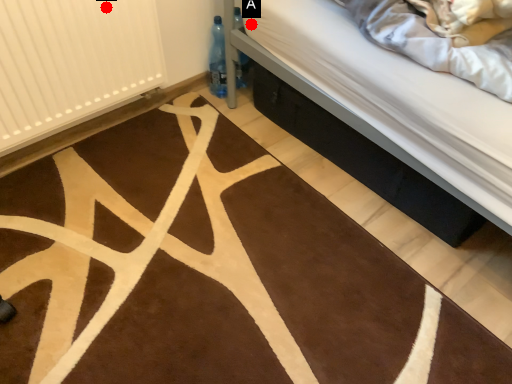
Question: Two points are circled on the image, labeled by A and B beside each circle. Which point appears closest to the camera in this image?

Choices:
 (A) A is closer
 (B) B is closer

Answer: (B)